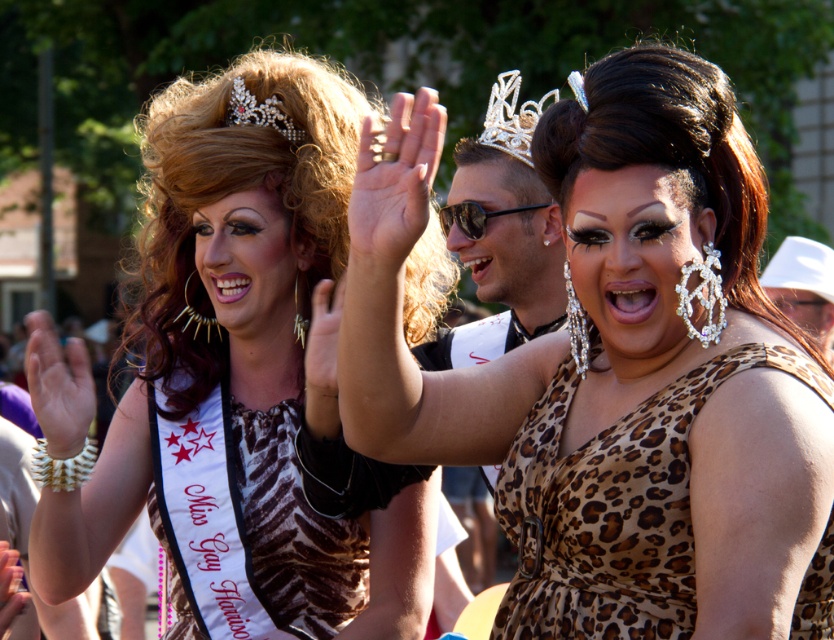
Is silver/crystal tiara at upper center smaller than pearl/sparkly tiara at upper left?

No, silver/crystal tiara at upper center is not smaller than pearl/sparkly tiara at upper left.

Can you confirm if silver/crystal tiara at upper center is wider than pearl/sparkly tiara at upper left?

Yes, silver/crystal tiara at upper center is wider than pearl/sparkly tiara at upper left.

At what (x,y) coordinates should I click in order to perform the action: click on silver/crystal tiara at upper center. Please return your answer as a coordinate pair (x, y). Looking at the image, I should click on (511, 116).

Measure the distance between leopard print fabric dress at center and pearl/sparkly tiara at upper left.

They are 1.70 meters apart.

Can you confirm if leopard print fabric dress at center is positioned to the left of pearl/sparkly tiara at upper left?

No, leopard print fabric dress at center is not to the left of pearl/sparkly tiara at upper left.

Is point (601, 529) farther from camera compared to point (284, 113)?

No, (601, 529) is in front of (284, 113).

Where is `leopard print fabric dress at center`? The image size is (834, 640). leopard print fabric dress at center is located at coordinates (614, 508).

Does zebra print dress at center have a larger size compared to black reflective sunglasses at center?

Indeed, zebra print dress at center has a larger size compared to black reflective sunglasses at center.

Which is behind, point (395, 593) or point (535, 204)?

The point (535, 204) is more distant.

Locate an element on the screen. zebra print dress at center is located at coordinates (229, 380).